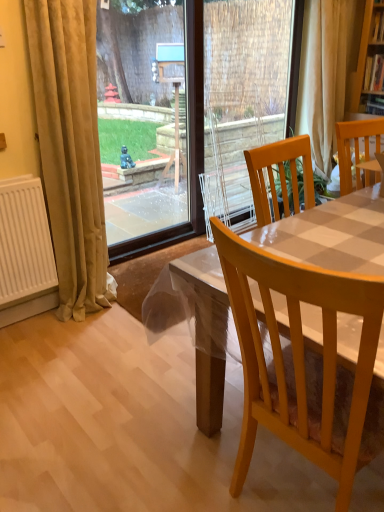
Question: Is light brown wooden chair at center, the 2th chair when ordered from back to front, looking in the opposite direction of beige velvet curtain at left, marked as the first curtain in a left-to-right arrangement?

Choices:
 (A) yes
 (B) no

Answer: (B)

Question: Is light brown wooden chair at center, which ranks as the 1th chair in front-to-back order, further to camera compared to beige velvet curtain at left, the second curtain viewed from the top?

Choices:
 (A) no
 (B) yes

Answer: (A)

Question: From a real-world perspective, is light brown wooden chair at center, marked as the first chair in a bottom-to-top arrangement, located beneath beige velvet curtain at left, arranged as the second curtain when viewed from the back?

Choices:
 (A) no
 (B) yes

Answer: (B)

Question: From the image's perspective, would you say light brown wooden chair at center, the second chair when ordered from right to left, is positioned over beige velvet curtain at left, which appears as the first curtain when viewed from the front?

Choices:
 (A) no
 (B) yes

Answer: (A)

Question: Does light brown wooden chair at center, the second chair when ordered from right to left, have a lesser width compared to beige velvet curtain at left, the second curtain viewed from the top?

Choices:
 (A) no
 (B) yes

Answer: (A)

Question: Does light brown wooden chair at center, the second chair when ordered from right to left, turn towards beige velvet curtain at left, marked as the 2th curtain in a right-to-left arrangement?

Choices:
 (A) no
 (B) yes

Answer: (A)

Question: Considering the relative positions of transparent glass door at upper left and beige fabric curtain at upper right, positioned as the 2th curtain in left-to-right order, in the image provided, is transparent glass door at upper left to the right of beige fabric curtain at upper right, positioned as the 2th curtain in left-to-right order, from the viewer's perspective?

Choices:
 (A) no
 (B) yes

Answer: (A)

Question: Can you confirm if transparent glass door at upper left is taller than beige fabric curtain at upper right, which is the 2th curtain from bottom to top?

Choices:
 (A) no
 (B) yes

Answer: (B)

Question: Is beige fabric curtain at upper right, marked as the 1th curtain in a back-to-front arrangement, inside transparent glass door at upper left?

Choices:
 (A) no
 (B) yes

Answer: (A)

Question: Could you tell me if transparent glass door at upper left is turned towards beige fabric curtain at upper right, marked as the first curtain in a right-to-left arrangement?

Choices:
 (A) no
 (B) yes

Answer: (A)

Question: From a real-world perspective, does transparent glass door at upper left stand above beige fabric curtain at upper right, positioned as the 2th curtain in left-to-right order?

Choices:
 (A) yes
 (B) no

Answer: (B)

Question: Considering the relative sizes of transparent glass door at upper left and beige fabric curtain at upper right, marked as the 1th curtain in a back-to-front arrangement, in the image provided, is transparent glass door at upper left thinner than beige fabric curtain at upper right, marked as the 1th curtain in a back-to-front arrangement,?

Choices:
 (A) yes
 (B) no

Answer: (A)

Question: Is beige fabric curtain at upper right, marked as the 1th curtain in a back-to-front arrangement, positioned in front of beige velvet curtain at left, arranged as the second curtain when viewed from the back?

Choices:
 (A) yes
 (B) no

Answer: (B)